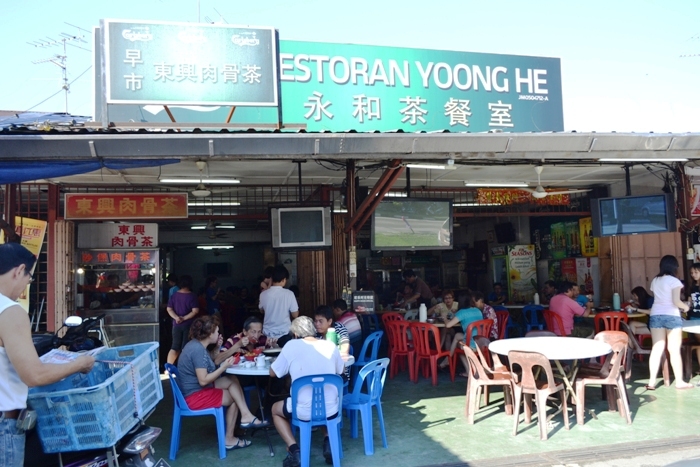
Find the location of a particular element. The image size is (700, 467). blue chairs is located at coordinates [183, 411], [309, 421], [367, 402], [372, 345].